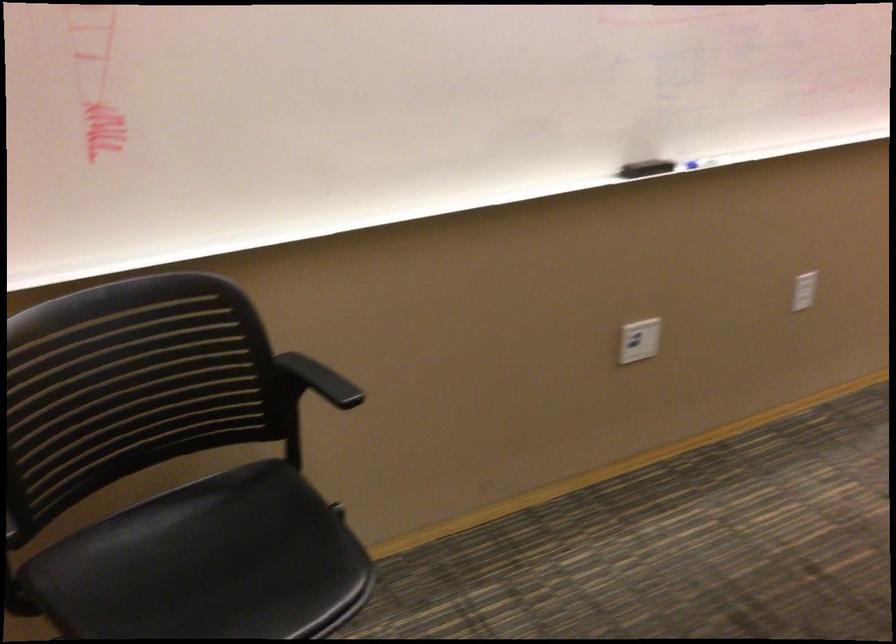
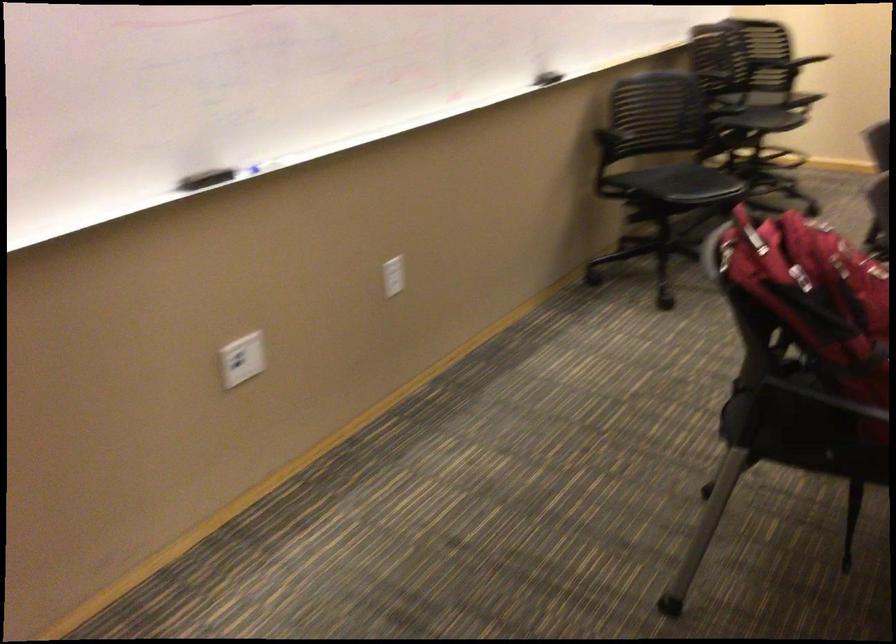
Question: The first image is from the beginning of the video and the second image is from the end. How did the camera likely rotate when shooting the video?

Choices:
 (A) Left
 (B) Right
 (C) Up
 (D) Down

Answer: (B)